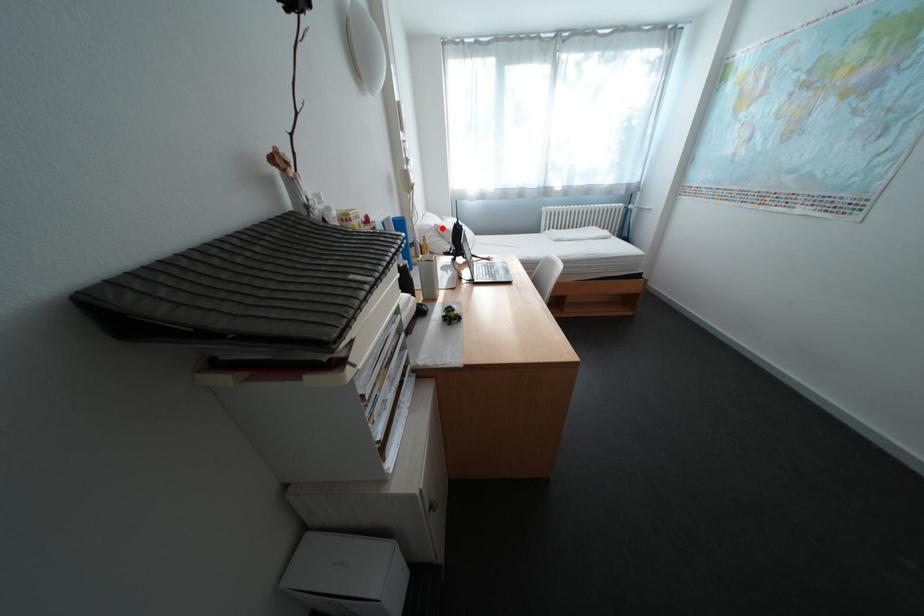
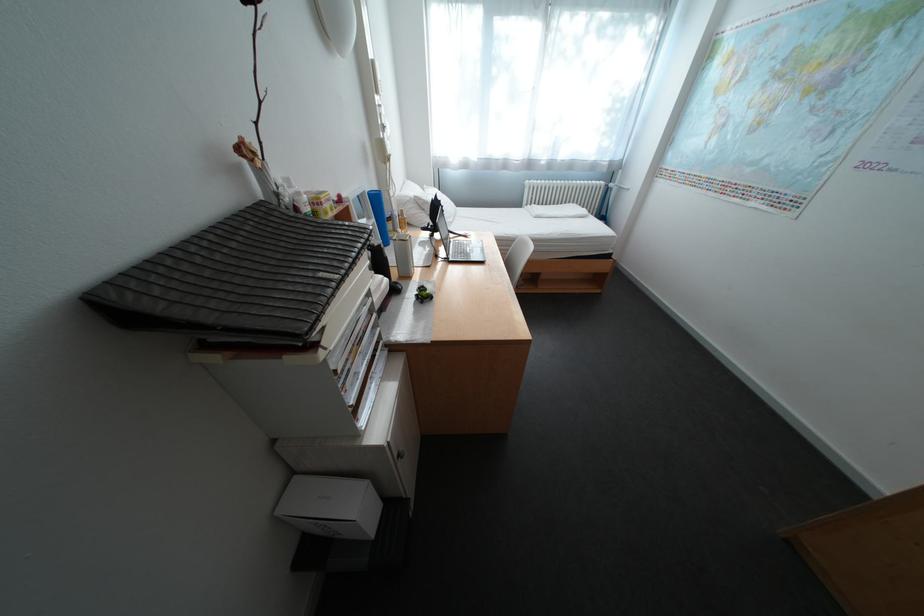
The point at the highlighted location is marked in the first image. Where is the corresponding point in the second image?

(420, 200)